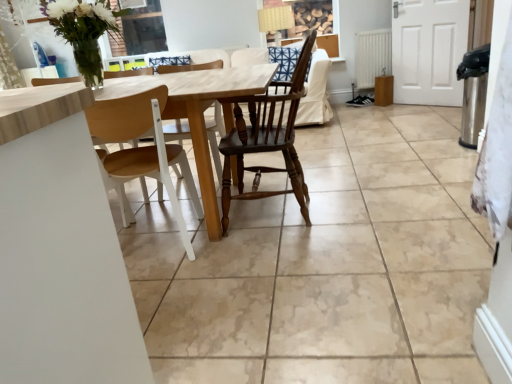
Measure the distance between point (507, 57) and camera.

The distance of point (507, 57) from camera is 33.19 inches.

The image size is (512, 384). What do you see at coordinates (372, 57) in the screenshot? I see `white matte radiator at right` at bounding box center [372, 57].

This screenshot has width=512, height=384. In order to click on dark wood chair at center, placed as the second chair when sorted from left to right in this screenshot , I will do `click(267, 138)`.

Does wooden at left, placed as the 2th chair when sorted from right to left, turn towards dark wood chair at center, positioned as the 1th chair in right-to-left order?

No, wooden at left, placed as the 2th chair when sorted from right to left, does not turn towards dark wood chair at center, positioned as the 1th chair in right-to-left order.

Consider the image. Would you say wooden at left, placed as the 2th chair when sorted from right to left, is inside or outside dark wood chair at center, placed as the second chair when sorted from left to right?

wooden at left, placed as the 2th chair when sorted from right to left, is located beyond the bounds of dark wood chair at center, placed as the second chair when sorted from left to right.

From the image's perspective, is wooden at left, placed as the 2th chair when sorted from right to left, positioned above or below dark wood chair at center, placed as the second chair when sorted from left to right?

Based on their image positions, wooden at left, placed as the 2th chair when sorted from right to left, is located beneath dark wood chair at center, placed as the second chair when sorted from left to right.

Is white matte radiator at right not close to dark wood chair at center, positioned as the 1th chair in right-to-left order?

Yes, white matte radiator at right and dark wood chair at center, positioned as the 1th chair in right-to-left order, are located far from each other.

Considering the points (391, 68) and (252, 188), which point is behind, point (391, 68) or point (252, 188)?

Positioned behind is point (391, 68).

Can you tell me how much white matte radiator at right and dark wood chair at center, placed as the second chair when sorted from left to right, differ in facing direction?

white matte radiator at right and dark wood chair at center, placed as the second chair when sorted from left to right, are facing 88.7 degrees away from each other.

Based on their positions, is white matte radiator at right located to the left or right of dark wood chair at center, positioned as the 1th chair in right-to-left order?

white matte radiator at right is to the right of dark wood chair at center, positioned as the 1th chair in right-to-left order.

Could you tell me if satin white towel at right is facing white matte radiator at right?

No, satin white towel at right is not oriented towards white matte radiator at right.

From a real-world perspective, does satin white towel at right sit lower than white matte radiator at right?

No, from a real-world perspective, satin white towel at right is not beneath white matte radiator at right.

Is the depth of satin white towel at right greater than that of white matte radiator at right?

That is False.

From the image's perspective, which one is positioned higher, light wood table at center or satin white towel at right?

light wood table at center.

Would you say light wood table at center is inside or outside satin white towel at right?

light wood table at center is not enclosed by satin white towel at right.

From the image's perspective, which is below, wooden at left, placed as the 2th chair when sorted from right to left, or satin white towel at right?

satin white towel at right is shown below in the image.

Is wooden at left, placed as the 2th chair when sorted from right to left, shorter than satin white towel at right?

No, wooden at left, placed as the 2th chair when sorted from right to left, is not shorter than satin white towel at right.

Is wooden at left, placed as the 2th chair when sorted from right to left, touching satin white towel at right?

They are not placed beside each other.

Choose the correct answer: Is wooden at left, placed as the 2th chair when sorted from right to left, inside satin white towel at right or outside it?

wooden at left, placed as the 2th chair when sorted from right to left, is outside satin white towel at right.

Is white matte radiator at right oriented away from wooden at left, placed as the first chair when sorted from left to right?

No, white matte radiator at right's orientation is not away from wooden at left, placed as the first chair when sorted from left to right.

Between point (364, 81) and point (106, 140), which one is positioned in front?

The point (106, 140) is closer to the camera.

Are white matte radiator at right and wooden at left, placed as the first chair when sorted from left to right, beside each other?

There is a gap between white matte radiator at right and wooden at left, placed as the first chair when sorted from left to right.

Can you confirm if white matte radiator at right is bigger than wooden at left, placed as the 2th chair when sorted from right to left?

Incorrect, white matte radiator at right is not larger than wooden at left, placed as the 2th chair when sorted from right to left.

Is dark wood chair at center, positioned as the 1th chair in right-to-left order, shorter than white matte radiator at right?

No, dark wood chair at center, positioned as the 1th chair in right-to-left order, is not shorter than white matte radiator at right.

Identify the location of the 1st chair to the left of the white matte radiator at right, counting from the anchor's position. This screenshot has height=384, width=512. (267, 138).

Can you confirm if dark wood chair at center, positioned as the 1th chair in right-to-left order, is wider than white matte radiator at right?

Yes, dark wood chair at center, positioned as the 1th chair in right-to-left order, is wider than white matte radiator at right.

Locate an element on the screen. chair above the wooden at left, placed as the first chair when sorted from left to right (from the image's perspective) is located at coordinates (267, 138).

From the image's perspective, starting from the white matte radiator at right, which chair is the 1st one below? Please provide its 2D coordinates.

[(267, 138)]

Which object lies further to the anchor point wooden at left, placed as the first chair when sorted from left to right, white matte radiator at right or satin white towel at right?

Based on the image, white matte radiator at right appears to be further to wooden at left, placed as the first chair when sorted from left to right.

Estimate the real-world distances between objects in this image. Which object is further from dark wood chair at center, placed as the second chair when sorted from left to right, white matte radiator at right or light wood table at center?

white matte radiator at right is positioned further to the anchor dark wood chair at center, placed as the second chair when sorted from left to right.

Which object lies further to the anchor point light wood table at center, white matte radiator at right or satin white towel at right?

The object further to light wood table at center is white matte radiator at right.

Looking at the image, which one is located closer to satin white towel at right, white matte radiator at right or light wood table at center?

Based on the image, light wood table at center appears to be nearer to satin white towel at right.

Looking at the image, which one is located closer to light wood table at center, satin white towel at right or wooden at left, placed as the 2th chair when sorted from right to left?

Based on the image, wooden at left, placed as the 2th chair when sorted from right to left, appears to be nearer to light wood table at center.

From the image, which object appears to be nearer to wooden at left, placed as the first chair when sorted from left to right, dark wood chair at center, placed as the second chair when sorted from left to right, or white matte radiator at right?

dark wood chair at center, placed as the second chair when sorted from left to right, is closer to wooden at left, placed as the first chair when sorted from left to right.

Which object lies further to the anchor point light wood table at center, wooden at left, placed as the 2th chair when sorted from right to left, or white matte radiator at right?

Among the two, white matte radiator at right is located further to light wood table at center.

Estimate the real-world distances between objects in this image. Which object is further from light wood table at center, dark wood chair at center, positioned as the 1th chair in right-to-left order, or white matte radiator at right?

white matte radiator at right is further to light wood table at center.

You are a GUI agent. You are given a task and a screenshot of the screen. Output one action in this format:
    pyautogui.click(x=<x>, y=<y>)
    Task: Click on the chair positioned between light wood table at center and white matte radiator at right from near to far
    Image resolution: width=512 pixels, height=384 pixels.
    Given the screenshot: What is the action you would take?
    pyautogui.click(x=267, y=138)

You are a GUI agent. You are given a task and a screenshot of the screen. Output one action in this format:
    pyautogui.click(x=<x>, y=<y>)
    Task: Click on the kitchen & dining room table between wooden at left, placed as the first chair when sorted from left to right, and white matte radiator at right from front to back
    This screenshot has height=384, width=512.
    Given the screenshot: What is the action you would take?
    pyautogui.click(x=195, y=112)

At what (x,y) coordinates should I click in order to perform the action: click on chair situated between light wood table at center and dark wood chair at center, positioned as the 1th chair in right-to-left order, from left to right. Please return your answer as a coordinate pair (x, y). Image resolution: width=512 pixels, height=384 pixels. Looking at the image, I should click on (142, 151).

Locate an element on the screen. chair between satin white towel at right and dark wood chair at center, placed as the second chair when sorted from left to right, from front to back is located at coordinates (142, 151).